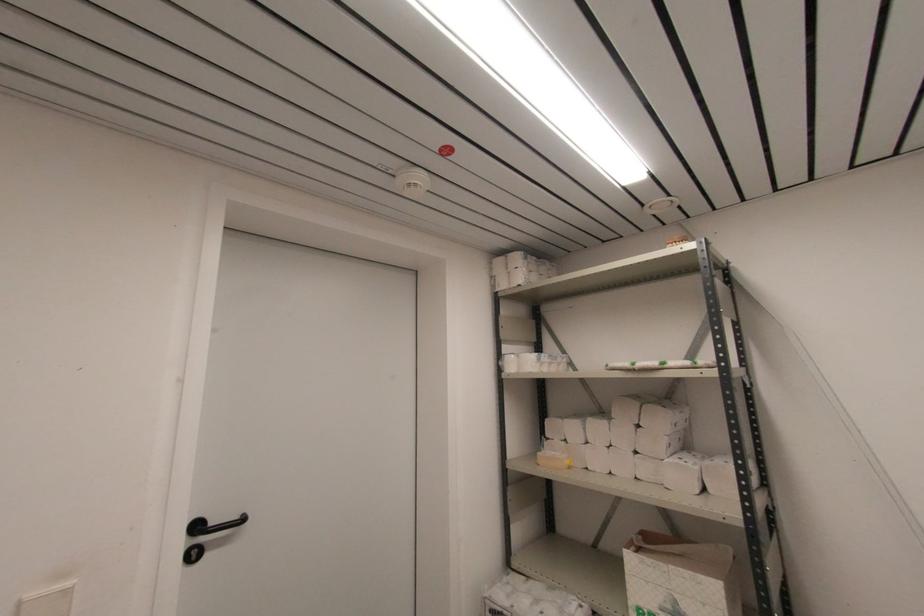
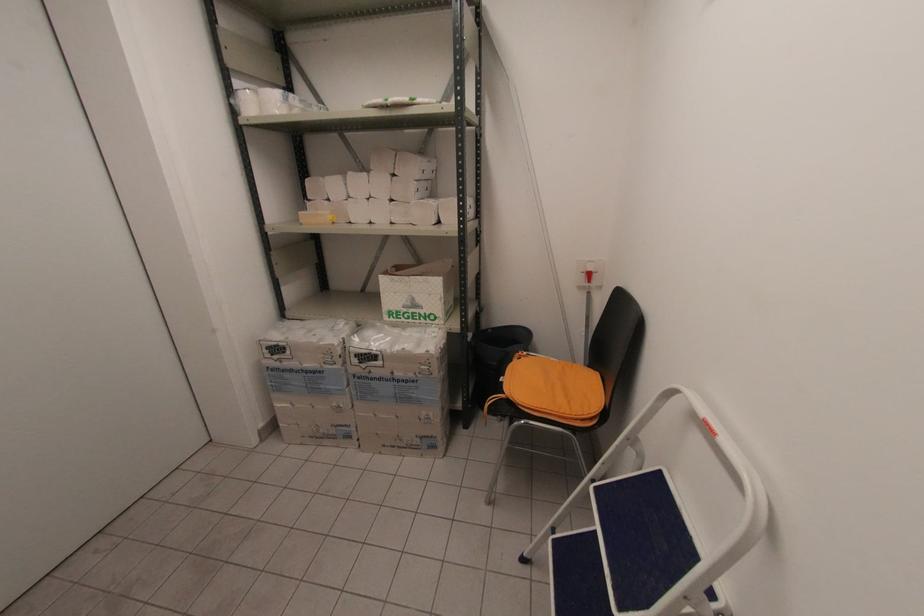
Based on the continuous images, in which direction is the camera rotating?

The camera rotated toward right-down.